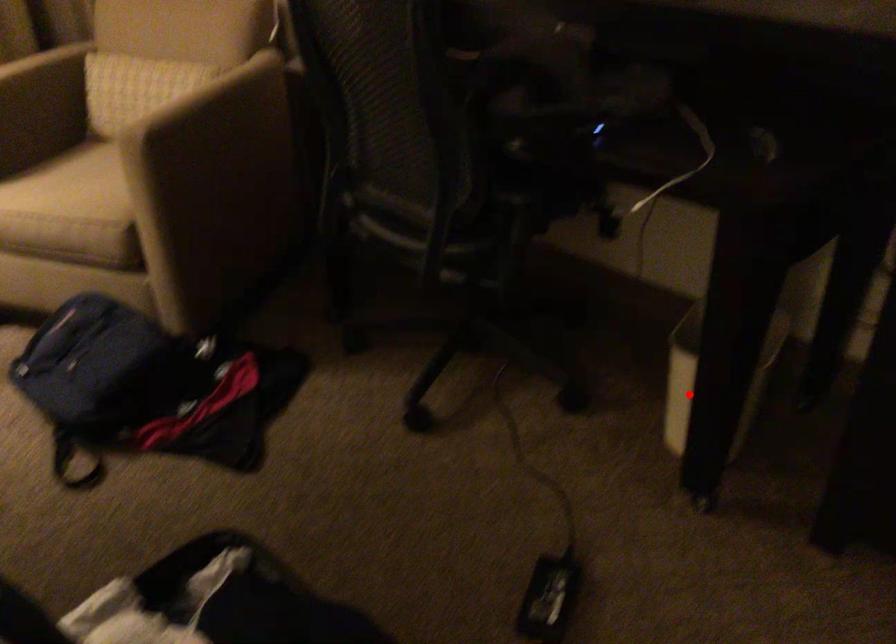
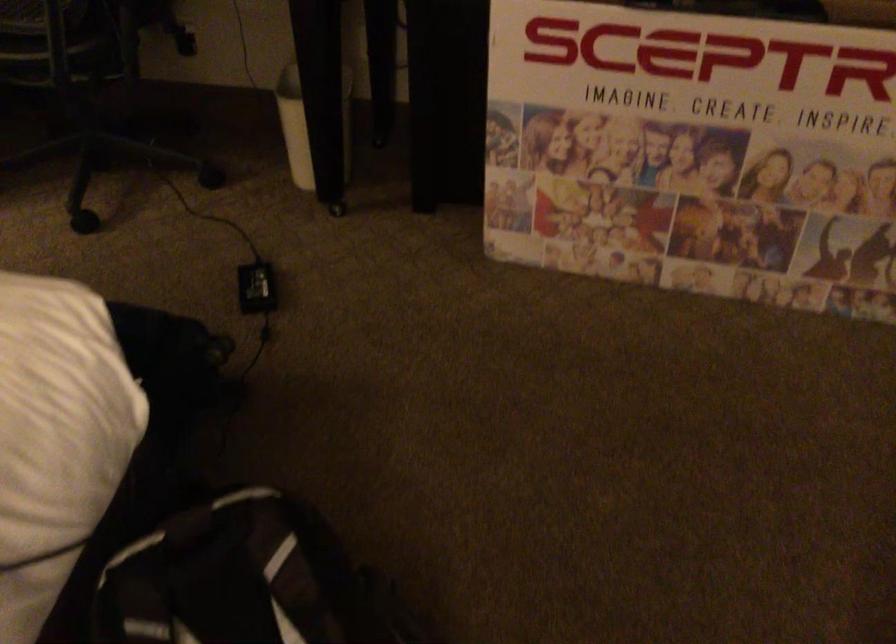
Question: A red point is marked in image1. In image2, is the corresponding 3D point closer to the camera or farther? Reply with the corresponding letter.

Choices:
 (A) The corresponding 3D point is closer.
 (B) The corresponding 3D point is farther.

Answer: (B)